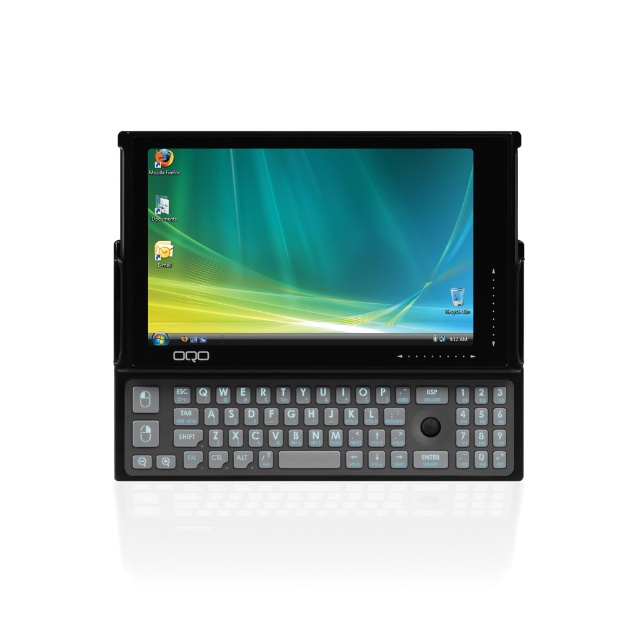
Question: Is black plastic tablet at center bigger than shiny plastic screen at center?

Choices:
 (A) yes
 (B) no

Answer: (A)

Question: Which point appears farthest from the camera in this image?

Choices:
 (A) (461, 182)
 (B) (214, 264)

Answer: (B)

Question: Is black plastic tablet at center above shiny plastic screen at center?

Choices:
 (A) no
 (B) yes

Answer: (A)

Question: Observing the image, what is the correct spatial positioning of black plastic tablet at center in reference to shiny plastic screen at center?

Choices:
 (A) left
 (B) right

Answer: (B)

Question: Which object is closer to the camera taking this photo?

Choices:
 (A) black plastic tablet at center
 (B) shiny plastic screen at center

Answer: (A)